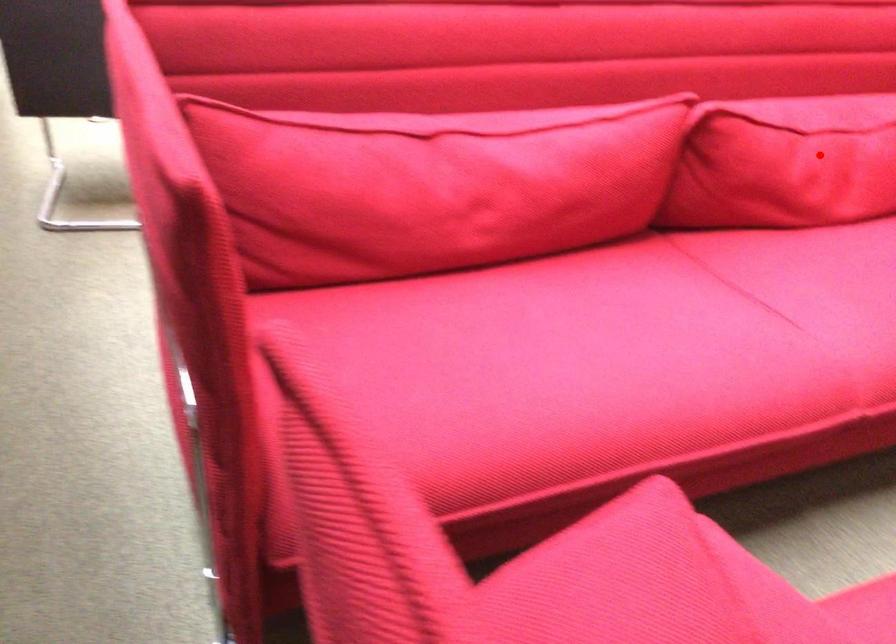
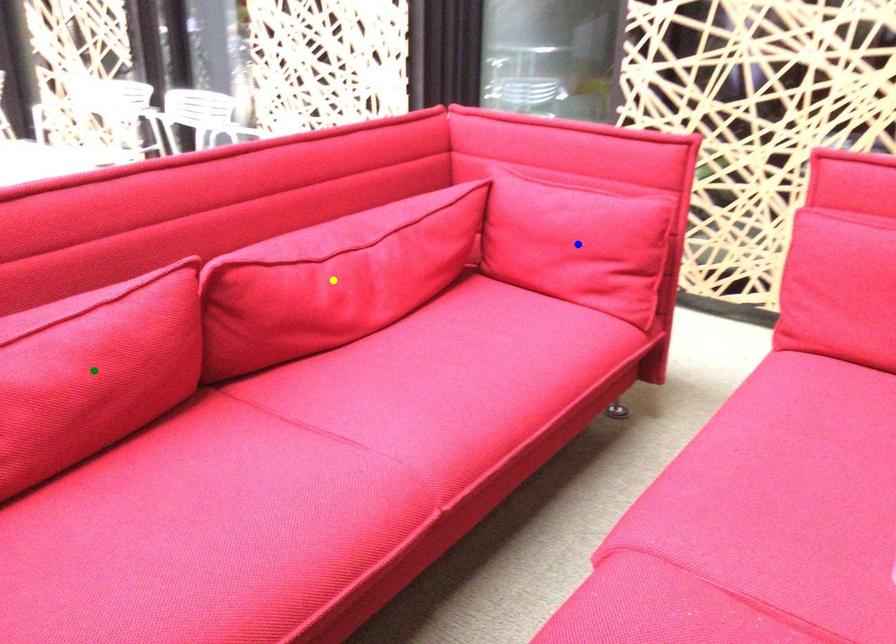
Question: I am providing you with two images of the same scene from different viewpoints. A red point is marked on the first image. You are given multiple points on the second image. Which spot in image 2 lines up with the point in image 1?

Choices:
 (A) blue point
 (B) yellow point
 (C) green point

Answer: (B)